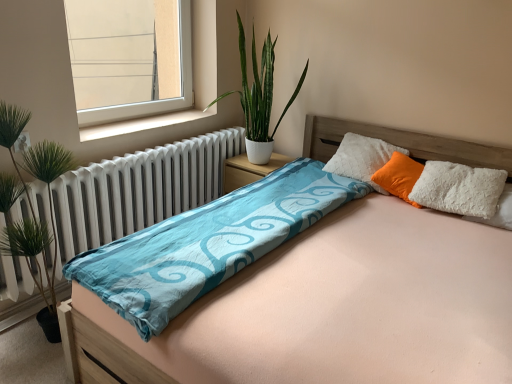
Question: Is orange soft pillow at upper right bigger than white matte nightstand at center?

Choices:
 (A) yes
 (B) no

Answer: (B)

Question: Considering the relative sizes of orange soft pillow at upper right and white matte nightstand at center in the image provided, is orange soft pillow at upper right thinner than white matte nightstand at center?

Choices:
 (A) yes
 (B) no

Answer: (A)

Question: Is orange soft pillow at upper right oriented towards white matte nightstand at center?

Choices:
 (A) yes
 (B) no

Answer: (B)

Question: From the image's perspective, is orange soft pillow at upper right on white matte nightstand at center?

Choices:
 (A) no
 (B) yes

Answer: (B)

Question: Is orange soft pillow at upper right far away from white matte nightstand at center?

Choices:
 (A) yes
 (B) no

Answer: (B)

Question: From the image's perspective, is white metallic radiator at left above or below transparent glass window at upper left?

Choices:
 (A) below
 (B) above

Answer: (A)

Question: From a real-world perspective, is white metallic radiator at left physically located above or below transparent glass window at upper left?

Choices:
 (A) above
 (B) below

Answer: (B)

Question: In terms of width, does white metallic radiator at left look wider or thinner when compared to transparent glass window at upper left?

Choices:
 (A) thin
 (B) wide

Answer: (B)

Question: Does point (156, 158) appear closer or farther from the camera than point (83, 21)?

Choices:
 (A) farther
 (B) closer

Answer: (B)

Question: Considering their positions, is white matte nightstand at center located in front of or behind white metallic radiator at left?

Choices:
 (A) behind
 (B) front

Answer: (A)

Question: Considering the positions of white matte nightstand at center and white metallic radiator at left in the image, is white matte nightstand at center taller or shorter than white metallic radiator at left?

Choices:
 (A) short
 (B) tall

Answer: (A)

Question: Is white matte nightstand at center situated inside white metallic radiator at left or outside?

Choices:
 (A) inside
 (B) outside

Answer: (B)

Question: Is white matte nightstand at center wider or thinner than white metallic radiator at left?

Choices:
 (A) thin
 (B) wide

Answer: (A)

Question: Considering the positions of light pink fabric bed at center and orange soft pillow at upper right in the image, is light pink fabric bed at center wider or thinner than orange soft pillow at upper right?

Choices:
 (A) thin
 (B) wide

Answer: (B)

Question: Based on their positions, is light pink fabric bed at center located to the left or right of orange soft pillow at upper right?

Choices:
 (A) left
 (B) right

Answer: (A)